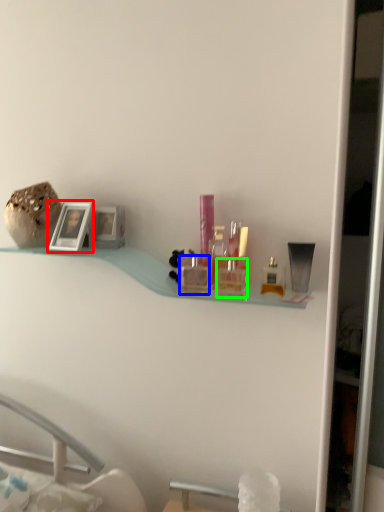
Question: Which is nearer to the picture frame (highlighted by a red box)? toiletry (highlighted by a blue box) or toiletry (highlighted by a green box).

Choices:
 (A) toiletry
 (B) toiletry

Answer: (A)